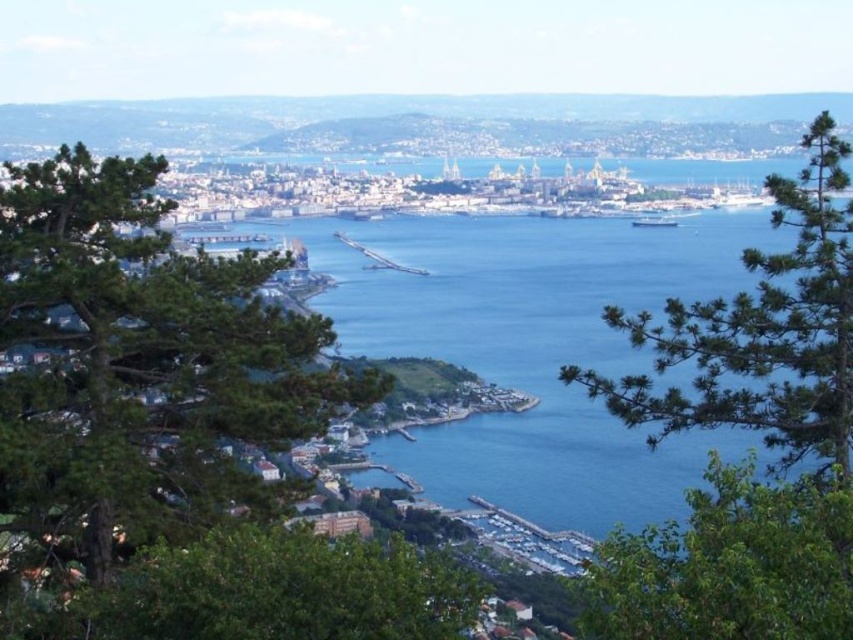
Question: Which point is closer to the camera?

Choices:
 (A) (73, 244)
 (B) (844, 177)
 (C) (677, 506)
 (D) (660, 216)

Answer: (A)

Question: Which is farther from the green leafy tree at center?

Choices:
 (A) blue water at center
 (B) green leafy tree at lower center

Answer: (B)

Question: Which point is farther to the camera?

Choices:
 (A) (665, 216)
 (B) (569, 371)
 (C) (438, 566)
 (D) (427, 268)

Answer: (A)

Question: Can you confirm if green leafy tree at center is positioned below green leafy tree at lower center?

Choices:
 (A) no
 (B) yes

Answer: (A)

Question: Is green leafy tree at center to the left of blue metallic ship at center from the viewer's perspective?

Choices:
 (A) yes
 (B) no

Answer: (B)

Question: From the image, what is the correct spatial relationship of green leafy tree at lower center in relation to green leafy tree at lower right?

Choices:
 (A) left
 (B) right

Answer: (A)